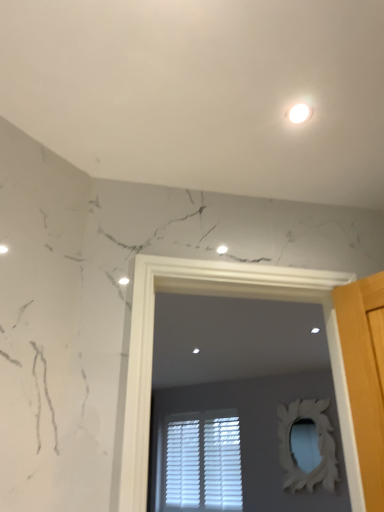
Image resolution: width=384 pixels, height=512 pixels. What do you see at coordinates (199, 462) in the screenshot? I see `white plastic blinds at center` at bounding box center [199, 462].

Image resolution: width=384 pixels, height=512 pixels. I want to click on white plastic blinds at center, so click(x=199, y=462).

Measure the distance between point [230,422] and camera.

The distance of point [230,422] from camera is 4.89 meters.

The width and height of the screenshot is (384, 512). Find the location of `white plastic blinds at center`. white plastic blinds at center is located at coordinates (199, 462).